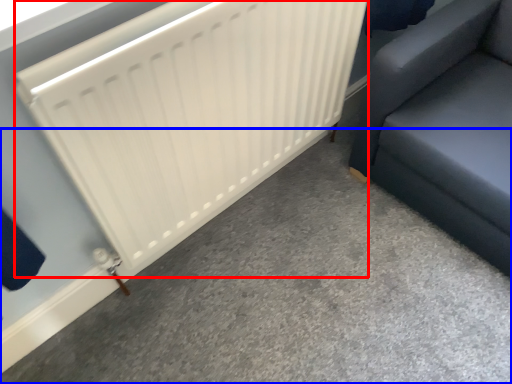
Question: Among these objects, which one is nearest to the camera, radiator (highlighted by a red box) or concrete (highlighted by a blue box)?

Choices:
 (A) radiator
 (B) concrete

Answer: (A)